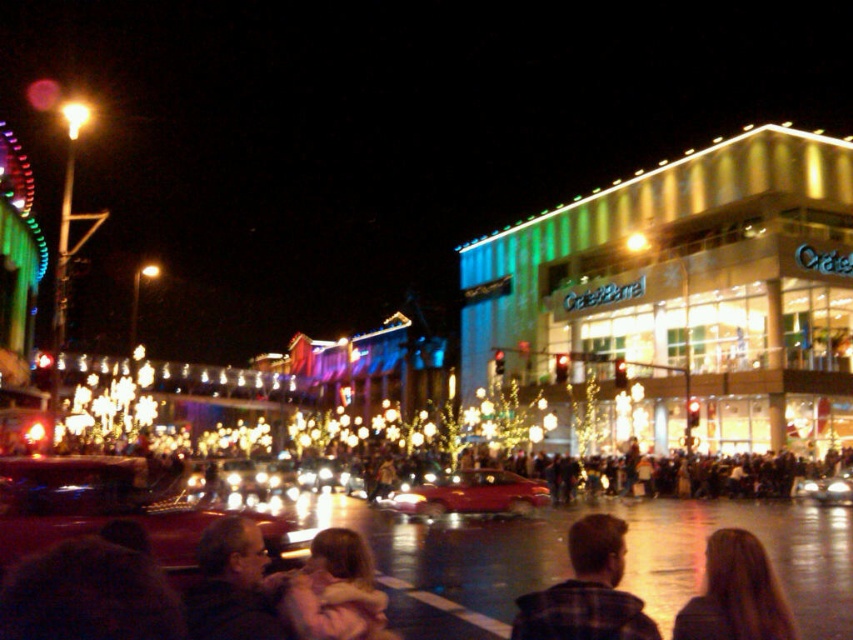
You are a photographer trying to capture a candid shot of the blonde hair at center from your camera. Given that the camera has a maximum focus range of 130 feet, will you be able to focus on the subject?

The blonde hair at center and camera are 133.07 feet apart, which exceeds the camera maximum focus range of 130 feet. Therefore, you won the able to focus on the subject.

You are a photographer trying to capture the festive atmosphere. You notice the plaid fabric shirt at center and the shiny silver car at center in your frame. Which object should you focus on if you want to highlight something taller in the scene?

The plaid fabric shirt at center is taller than the shiny silver car at center, so focusing on the plaid fabric shirt at center would highlight the taller object in the scene.

You are at the event and want to locate someone wearing a plaid fabric shirt at center and someone with blonde hair at center. Which one is positioned more to the right?

The plaid fabric shirt at center is positioned to the right of the blonde hair at center.